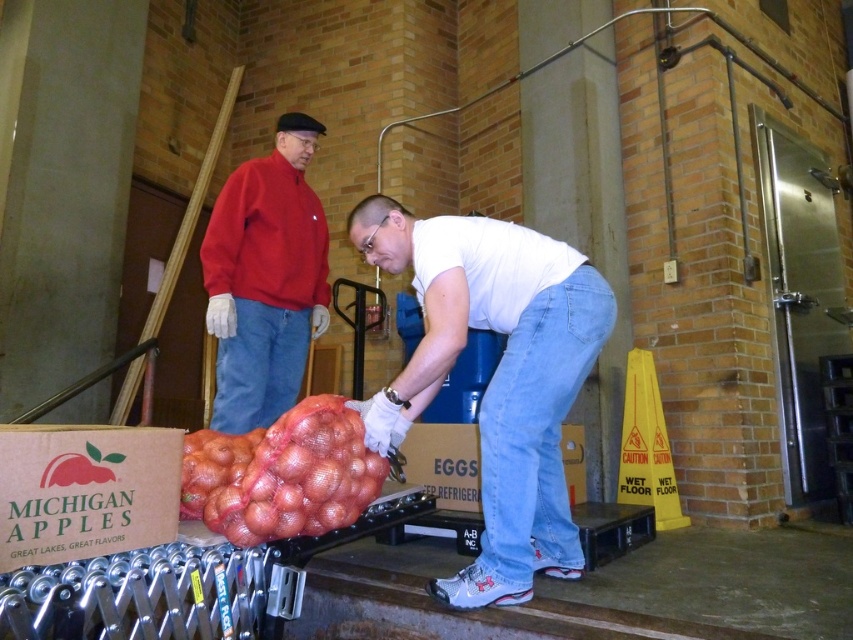
You are a warehouse inspector checking safety protocols. You notice the light blue denim jeans at lower center and the red mesh bag of apples at center. According to safety guidelines, the minimum safe distance between workers and stored items should be at least 24 inches to prevent tripping hazards. Is the current distance compliant with this requirement?

The distance between the light blue denim jeans at lower center and the red mesh bag of apples at center is 20.90 inches, which is less than the required 24 inches. Therefore, the current setup does not comply with the safety guidelines.

You are an inspector checking the warehouse layout. You notice the red fleece jacket at upper left and the red mesh bag of apples at center. Which object is wider?

The red mesh bag of apples at center is wider than the red fleece jacket at upper left.

You are standing in the warehouse and need to locate both the red fleece jacket at upper left and the blue denim jeans at center. According to the scene description, which object is positioned to the right of the other?

The red fleece jacket at upper left is to the right of the blue denim jeans at center.